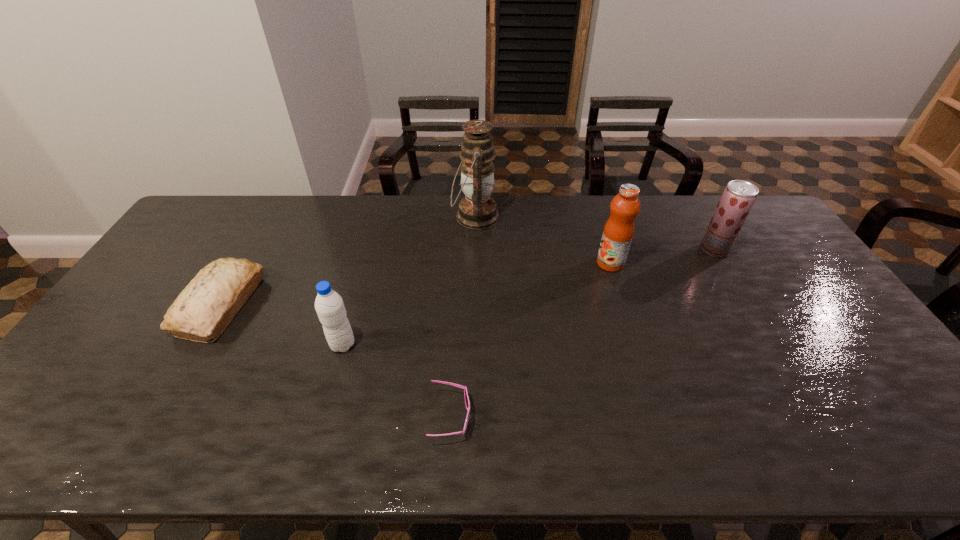
This screenshot has height=540, width=960. What are the coordinates of `free space at the far edge` in the screenshot? It's located at 703,213.

The width and height of the screenshot is (960, 540). In order to click on blank area at the near edge in this screenshot , I will do `click(740, 451)`.

I want to click on vacant space at the left edge of the desktop, so click(x=158, y=300).

Locate an element on the screen. Image resolution: width=960 pixels, height=540 pixels. free spot at the right edge of the desktop is located at coordinates (804, 320).

Locate an element on the screen. free spot between the fifth object from left to right and the bread is located at coordinates (416, 284).

You are a GUI agent. You are given a task and a screenshot of the screen. Output one action in this format:
    pyautogui.click(x=<x>, y=<y>)
    Task: Click on the vacant area that lies between the bread and the second object from left to right
    The image size is (960, 540).
    Given the screenshot: What is the action you would take?
    pyautogui.click(x=282, y=325)

You are a GUI agent. You are given a task and a screenshot of the screen. Output one action in this format:
    pyautogui.click(x=<x>, y=<y>)
    Task: Click on the empty space that is in between the right fruit juice and the tallest object
    This screenshot has width=960, height=540.
    Given the screenshot: What is the action you would take?
    pyautogui.click(x=594, y=233)

The image size is (960, 540). What are the coordinates of `empty space that is in between the left fruit juice and the rightmost object` in the screenshot? It's located at (x=662, y=256).

Find the location of a particular element. This screenshot has width=960, height=540. free space between the shortest object and the left fruit juice is located at coordinates (530, 340).

Locate an element on the screen. The height and width of the screenshot is (540, 960). vacant space that is in between the fifth object from right to left and the right fruit juice is located at coordinates (528, 297).